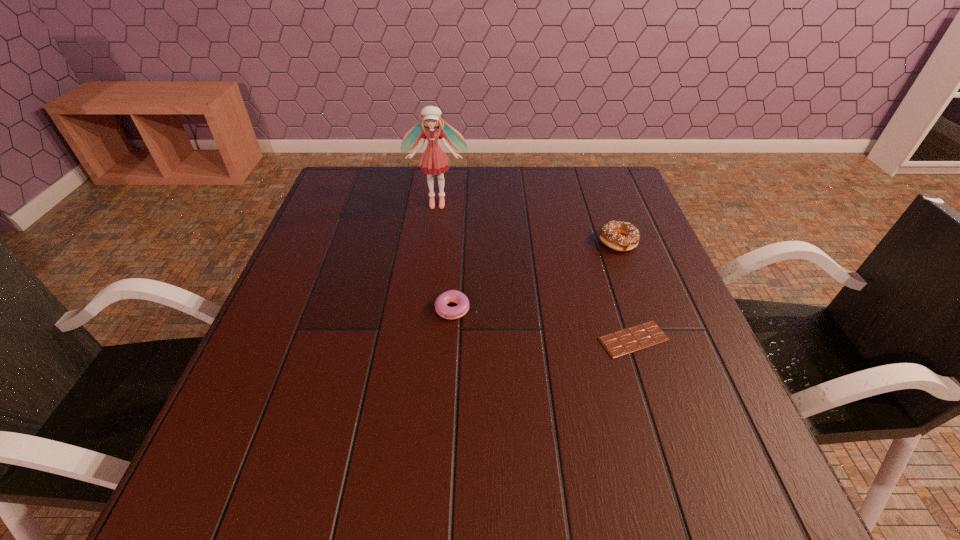
Where is `free space between the second shortest object and the doll`? The height and width of the screenshot is (540, 960). free space between the second shortest object and the doll is located at coordinates (446, 256).

Locate an element on the screen. The image size is (960, 540). free point between the third shortest object and the tallest object is located at coordinates (528, 222).

Where is `free area in between the farthest object and the second farthest object`? free area in between the farthest object and the second farthest object is located at coordinates (528, 222).

Locate an element on the screen. vacant space in between the third shortest object and the third tallest object is located at coordinates (537, 275).

You are a GUI agent. You are given a task and a screenshot of the screen. Output one action in this format:
    pyautogui.click(x=<x>, y=<y>)
    Task: Click on the free point between the shortest object and the doll
    The width and height of the screenshot is (960, 540).
    Given the screenshot: What is the action you would take?
    pyautogui.click(x=536, y=271)

Find the location of `free point between the right doughnut and the chocolate bar`. free point between the right doughnut and the chocolate bar is located at coordinates (626, 291).

Where is `vacant area that lies between the tallest object and the shortest object`? vacant area that lies between the tallest object and the shortest object is located at coordinates (536, 271).

Locate an element on the screen. This screenshot has width=960, height=540. free space between the third shortest object and the second shortest object is located at coordinates (537, 275).

Identify the location of free space between the shortest object and the taller doughnut. (626, 291).

You are a GUI agent. You are given a task and a screenshot of the screen. Output one action in this format:
    pyautogui.click(x=<x>, y=<y>)
    Task: Click on the object identified as the third closest to the second tallest object
    This screenshot has height=540, width=960.
    Given the screenshot: What is the action you would take?
    pyautogui.click(x=434, y=160)